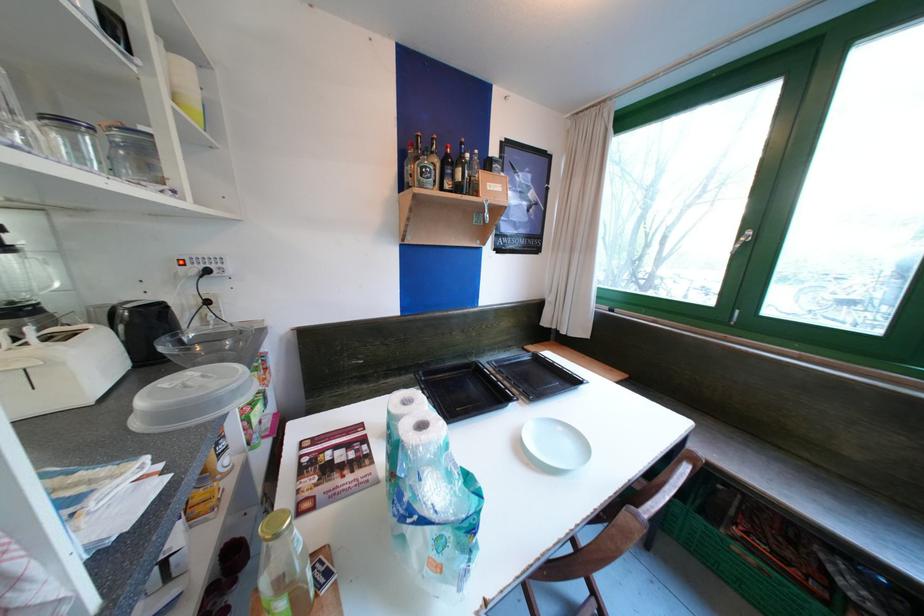
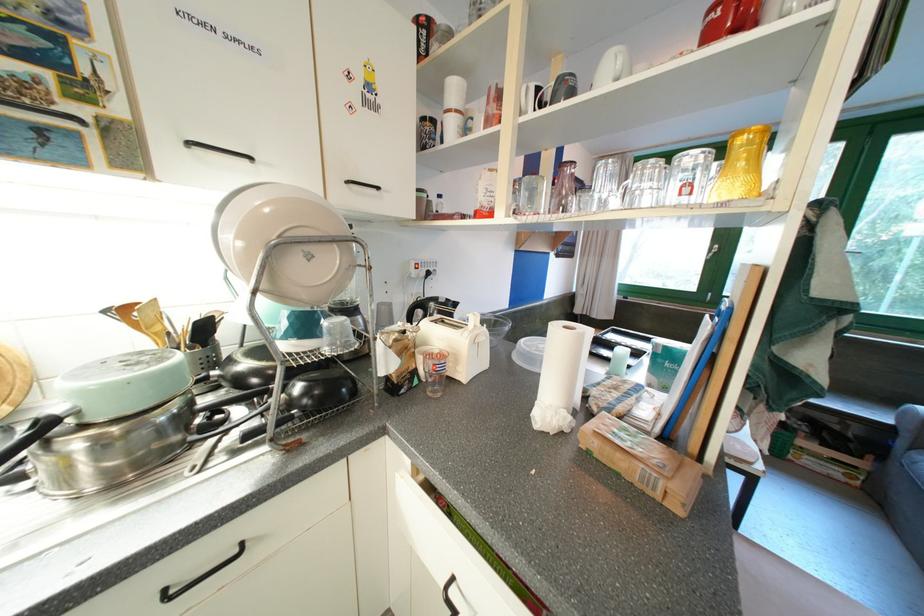
Question: I am providing you with two images of the same scene from different viewpoints. Please identify which objects are invisible in image2.

Choices:
 (A) paper towel roll
 (B) green window handle
 (C) small book
 (D) black baking tray

Answer: (D)